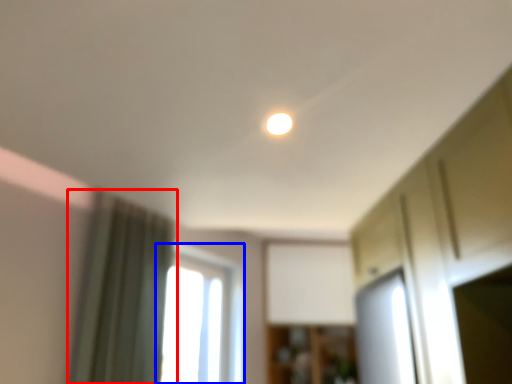
Question: Which of the following is the farthest to the observer, curtain (highlighted by a red box) or window (highlighted by a blue box)?

Choices:
 (A) curtain
 (B) window

Answer: (B)